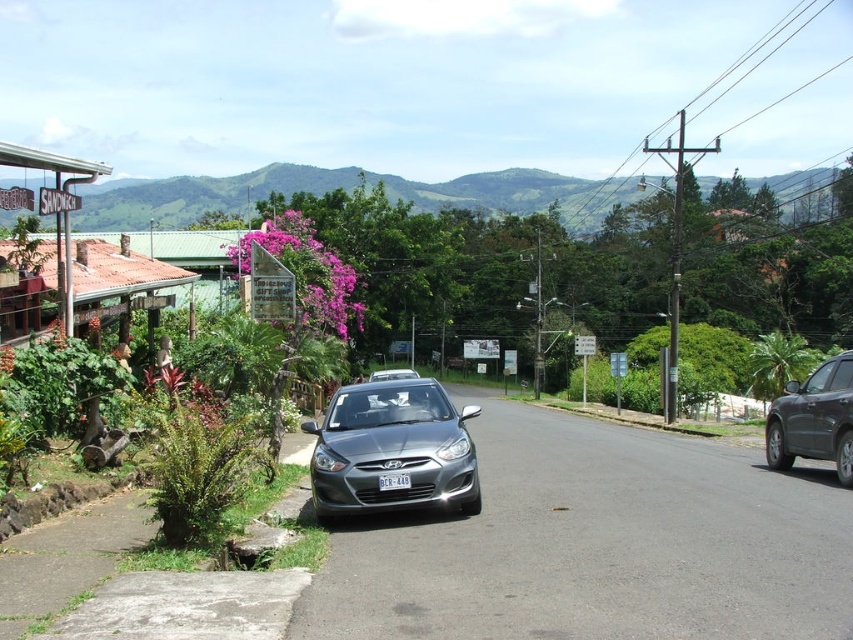
Question: Does satin metallic sedan at center have a smaller size compared to white plastic license plate at center?

Choices:
 (A) no
 (B) yes

Answer: (A)

Question: Which point is farther to the camera?

Choices:
 (A) white plastic license plate at center
 (B) satin metallic sedan at center
 (C) satin black suv at right
 (D) green leafy mountain at upper center

Answer: (D)

Question: Which point appears farthest from the camera in this image?

Choices:
 (A) (309, 182)
 (B) (473, 513)

Answer: (A)

Question: Among these points, which one is nearest to the camera?

Choices:
 (A) (781, 460)
 (B) (448, 486)
 (C) (381, 483)

Answer: (C)

Question: Where is satin black suv at right located in relation to white plastic license plate at center in the image?

Choices:
 (A) right
 (B) left

Answer: (A)

Question: Is green leafy mountain at upper center in front of satin black suv at right?

Choices:
 (A) yes
 (B) no

Answer: (B)